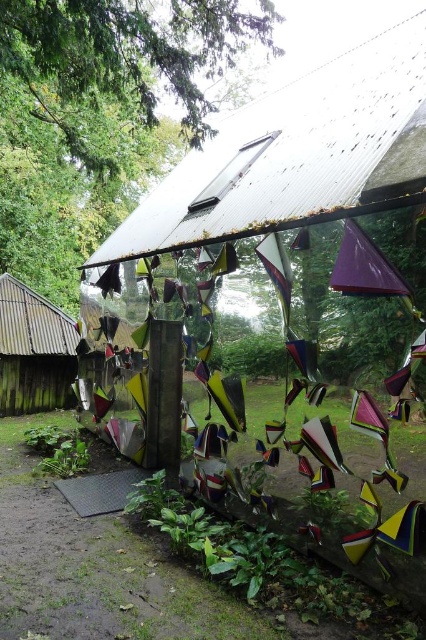
Between green leafy tree at upper left and wooden shingles hut at left, which one is positioned lower?

wooden shingles hut at left

Is green leafy tree at upper left further to camera compared to wooden shingles hut at left?

No, green leafy tree at upper left is closer to the viewer.

Where is `green leafy tree at upper left`? The image size is (426, 640). green leafy tree at upper left is located at coordinates (98, 115).